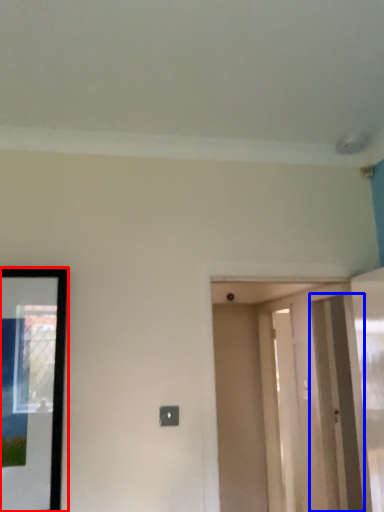
Question: Which point is further to the camera, picture frame (highlighted by a red box) or screen door (highlighted by a blue box)?

Choices:
 (A) picture frame
 (B) screen door

Answer: (B)